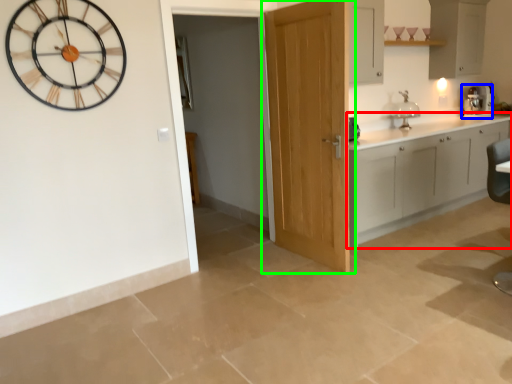
Question: Which is farther away from cabinetry (highlighted by a red box)? coffee machine (highlighted by a blue box) or door (highlighted by a green box)?

Choices:
 (A) coffee machine
 (B) door

Answer: (A)